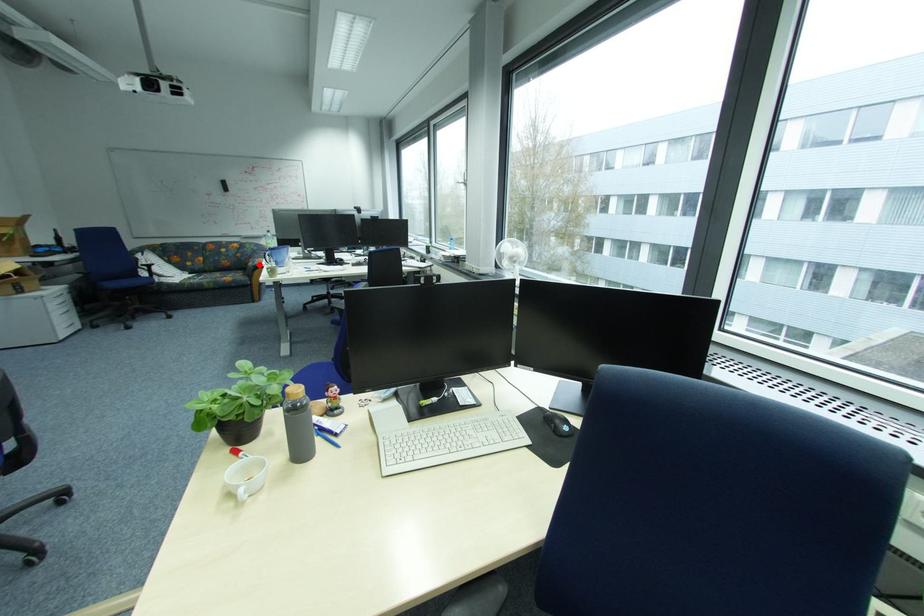
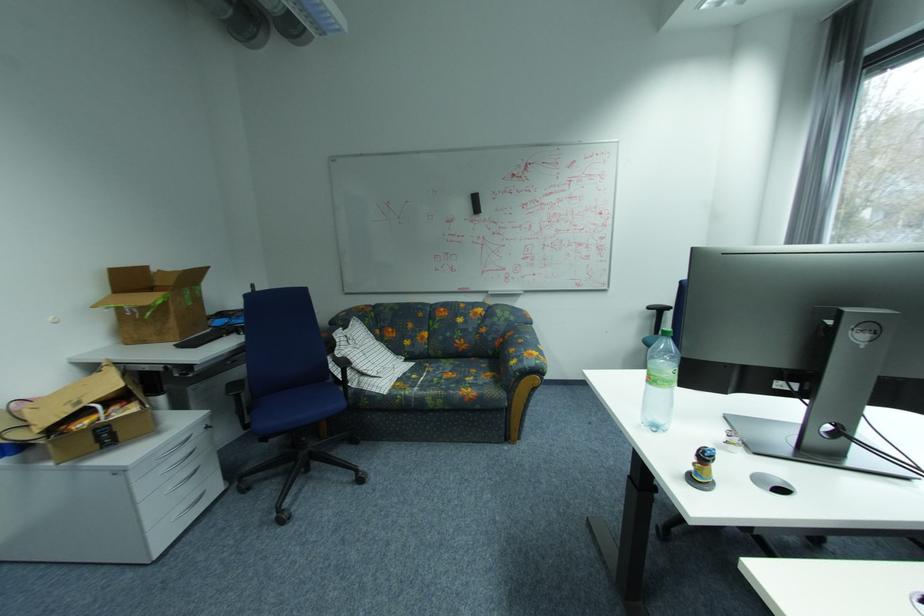
Where in the second image is the point corresponding to the highlighted location from the first image?

(521, 363)